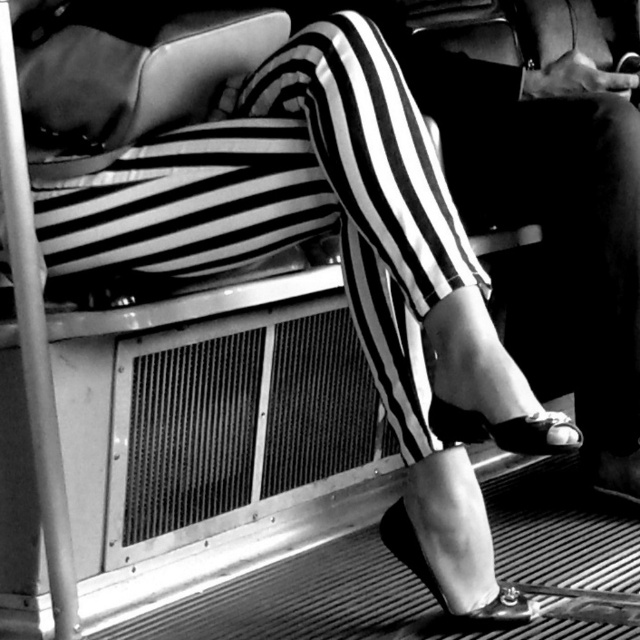
You are a photographer trying to capture both the shiny black sandal at lower center and the shiny patent leather sandal at lower center in the same frame. Given their sizes, which sandal will appear larger in the photo?

The shiny black sandal at lower center will appear larger in the photo because it is bigger than the shiny patent leather sandal at lower center.